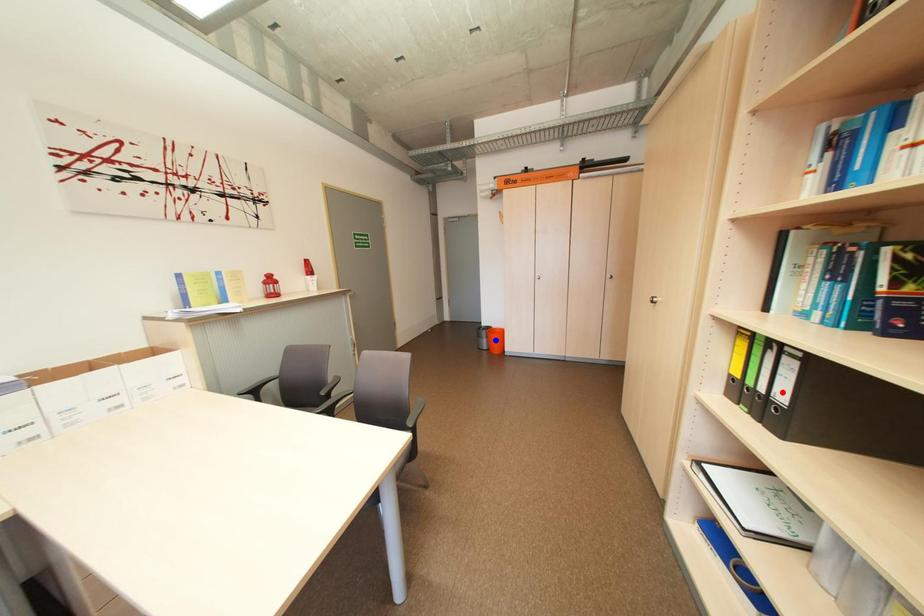
Question: Two points are marked on the image. Which point is closer to the camera?

Choices:
 (A) Blue point is closer.
 (B) Red point is closer.

Answer: (B)